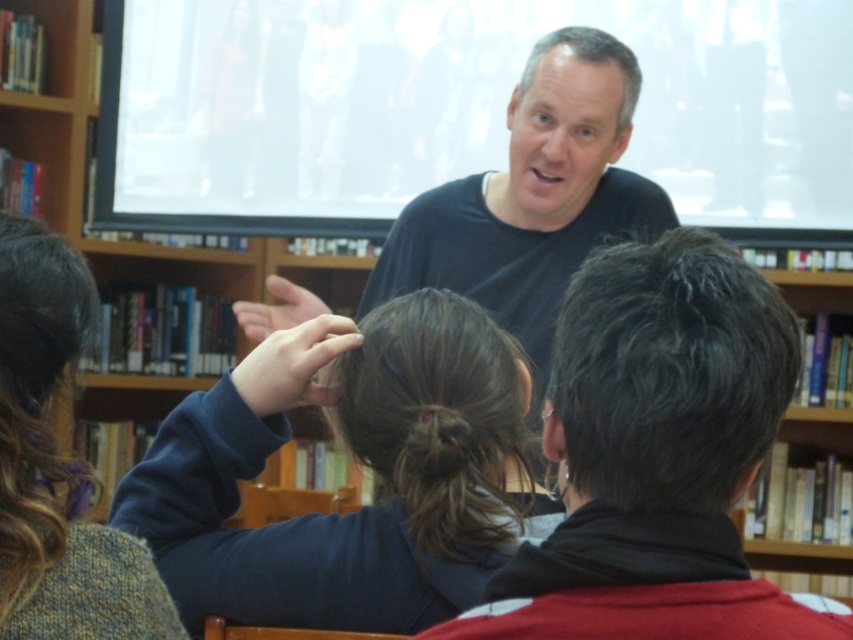
Question: Is dark blue sweater at center behind brown fuzzy hair at center?

Choices:
 (A) yes
 (B) no

Answer: (B)

Question: Is black matte shirt at center positioned in front of blonde curly hair at upper left?

Choices:
 (A) no
 (B) yes

Answer: (A)

Question: Can you confirm if brown fuzzy hair at center is positioned below blonde curly hair at upper left?

Choices:
 (A) yes
 (B) no

Answer: (A)

Question: Which point is farther to the camera?

Choices:
 (A) (138, 476)
 (B) (71, 460)
 (C) (625, 620)

Answer: (A)

Question: Which object is farther from the camera taking this photo?

Choices:
 (A) black matte shirt at center
 (B) knitted sweater at lower left

Answer: (A)

Question: Which point is closer to the camera?

Choices:
 (A) (436, 435)
 (B) (4, 515)
 (C) (592, 365)
 (D) (144, 625)

Answer: (C)